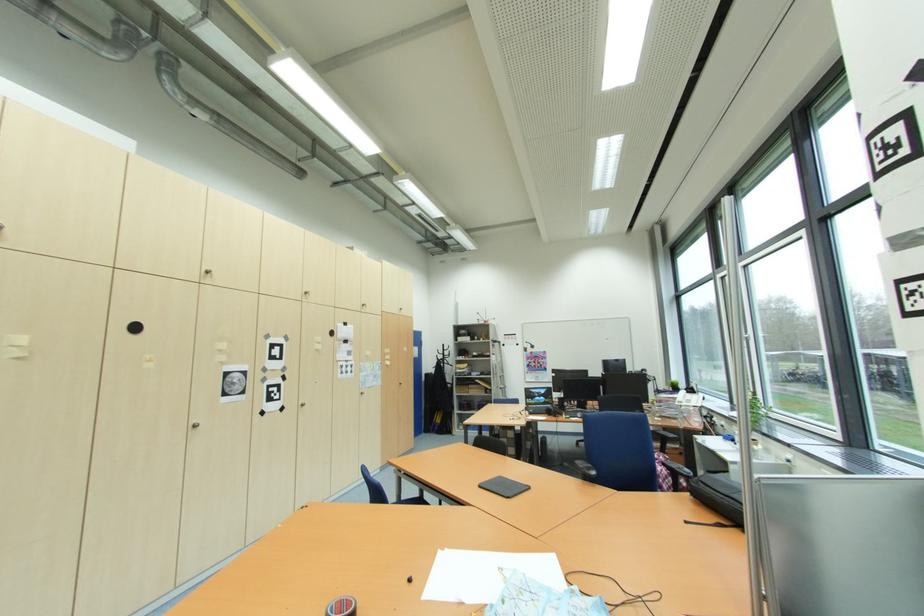
Find where to lift the white telephone. Please return your answer as a coordinate pair (x, y).

(688, 399)